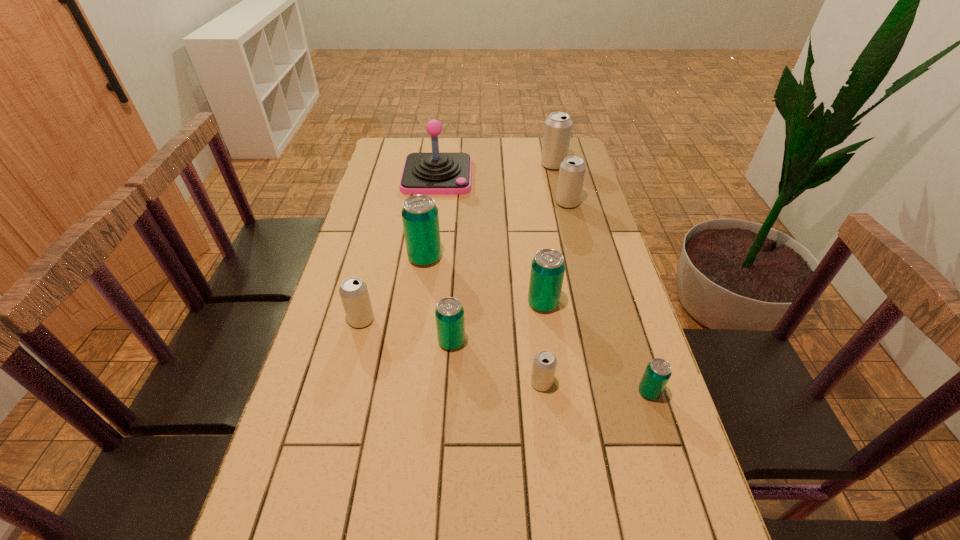
Where is `vacant space located 0.070m on the right of the seventh nearest beer can`? This screenshot has width=960, height=540. vacant space located 0.070m on the right of the seventh nearest beer can is located at coordinates (599, 203).

The height and width of the screenshot is (540, 960). Identify the location of blank area located on the back of the third nearest teal beer can. (539, 270).

Locate an element on the screen. vacant area situated on the back of the third nearest object is located at coordinates (455, 277).

The width and height of the screenshot is (960, 540). Find the location of `blank area located on the back of the second nearest white beer can`. blank area located on the back of the second nearest white beer can is located at coordinates (378, 254).

Identify the location of vacant point located on the right of the smallest white beer can. (660, 383).

Find the location of `free space located on the back of the rightmost object`. free space located on the back of the rightmost object is located at coordinates (616, 287).

Where is `joystick that is at the far edge`? joystick that is at the far edge is located at coordinates (435, 173).

Locate an element on the screen. The image size is (960, 540). beer can located in the far edge section of the desktop is located at coordinates (557, 131).

Locate an element on the screen. joystick that is at the left edge is located at coordinates point(435,173).

The height and width of the screenshot is (540, 960). I want to click on beer can that is at the left edge, so click(x=353, y=291).